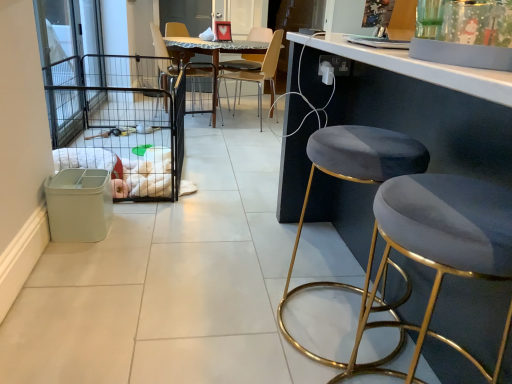
Locate an element on the screen. blank space situated above velvet/golden stool at right, the 1th stool in the front-to-back sequence (from a real-world perspective) is located at coordinates (451, 196).